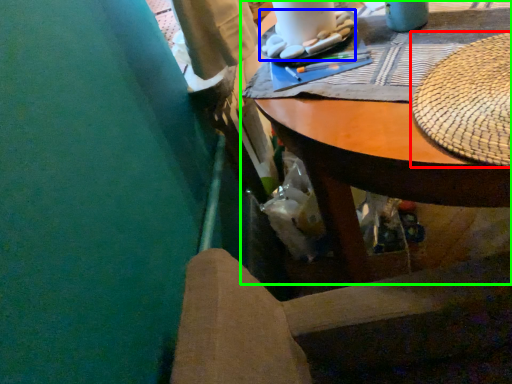
Question: Considering the real-world distances, which object is farthest from hat (highlighted by a red box)? food (highlighted by a blue box) or desk (highlighted by a green box)?

Choices:
 (A) food
 (B) desk

Answer: (A)